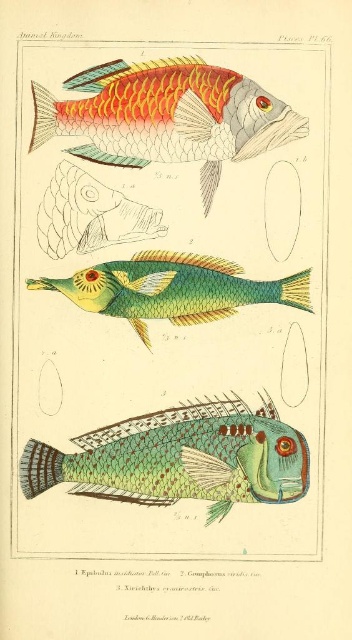
You are an underwater photographer aiming to capture a clear shot of both the top fish and the middle fish in the image. You notice two specific points marked on your camera screen at coordinates point (291, 496) and point (168, 305). To ensure both fish are in focus, which point should you prioritize focusing on first?

You should prioritize focusing on point (168, 305) first because it is behind point (291, 496), ensuring that both fish are within the depth of field.

You are an underwater photographer aiming to capture the shiny orange scales at upper center and the green iridescent fish at center in a single shot. Which fish should you focus on first to ensure both are in focus?

You should focus on the green iridescent fish at center first because the shiny orange scales at upper center is in front of it, so adjusting focus starting from the closer object ensures both are in focus.

You are an aquatic biologist observing the image. You need to determine which of the two fish has a wider body. The fish with shiny orange scales at upper center and the green iridescent fish at center are both in view. Can you identify which one has a wider body?

The shiny orange scales at upper center has a lesser width compared to green iridescent fish at center, so the green iridescent fish at center has a wider body.